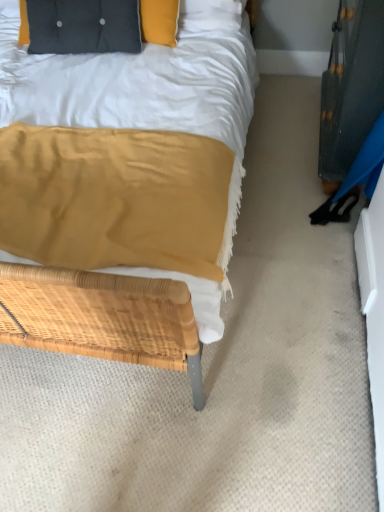
Question: Is black glossy dresser at right next to black tufted pillow at upper left?

Choices:
 (A) no
 (B) yes

Answer: (A)

Question: Would you say black glossy dresser at right is a long distance from black tufted pillow at upper left?

Choices:
 (A) no
 (B) yes

Answer: (B)

Question: Can we say black glossy dresser at right lies outside black tufted pillow at upper left?

Choices:
 (A) yes
 (B) no

Answer: (A)

Question: From a real-world perspective, does black glossy dresser at right stand above black tufted pillow at upper left?

Choices:
 (A) no
 (B) yes

Answer: (A)

Question: Is black glossy dresser at right facing away from black tufted pillow at upper left?

Choices:
 (A) no
 (B) yes

Answer: (A)

Question: From the image's perspective, is black glossy dresser at right on black tufted pillow at upper left?

Choices:
 (A) no
 (B) yes

Answer: (A)

Question: From a real-world perspective, is black tufted pillow at upper left over black glossy dresser at right?

Choices:
 (A) no
 (B) yes

Answer: (B)

Question: Is black tufted pillow at upper left facing away from black glossy dresser at right?

Choices:
 (A) no
 (B) yes

Answer: (A)

Question: Is black tufted pillow at upper left shorter than black glossy dresser at right?

Choices:
 (A) no
 (B) yes

Answer: (B)

Question: Considering the relative positions of black tufted pillow at upper left and black glossy dresser at right in the image provided, is black tufted pillow at upper left to the left of black glossy dresser at right from the viewer's perspective?

Choices:
 (A) yes
 (B) no

Answer: (A)

Question: Is black tufted pillow at upper left closer to the viewer compared to black glossy dresser at right?

Choices:
 (A) yes
 (B) no

Answer: (B)

Question: Does black tufted pillow at upper left have a smaller size compared to black glossy dresser at right?

Choices:
 (A) yes
 (B) no

Answer: (B)

Question: Considering the positions of black tufted pillow at upper left and black glossy dresser at right in the image, is black tufted pillow at upper left wider or thinner than black glossy dresser at right?

Choices:
 (A) wide
 (B) thin

Answer: (A)